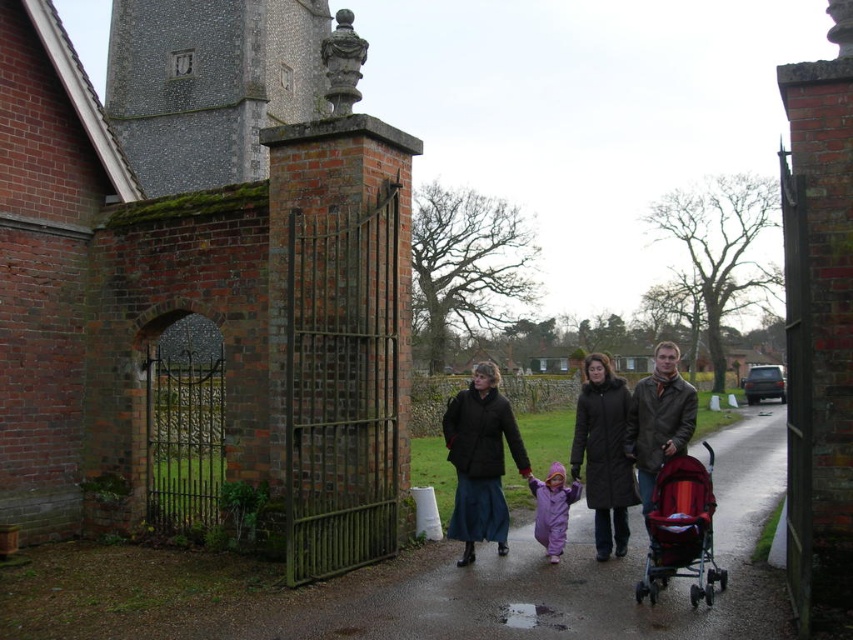
Question: Which of the following is the closest to the observer?

Choices:
 (A) quilted dark brown coat at center
 (B) matte black coat at center
 (C) purple fleece suit at center
 (D) purple fleece jacket at center

Answer: (D)

Question: Is matte black coat at center positioned at the back of red fabric stroller at right?

Choices:
 (A) no
 (B) yes

Answer: (B)

Question: Can you confirm if purple fleece jacket at center is positioned to the left of red fabric stroller at right?

Choices:
 (A) no
 (B) yes

Answer: (A)

Question: Among these objects, which one is farthest from the camera?

Choices:
 (A) matte black coat at center
 (B) quilted dark brown coat at center
 (C) purple fleece jacket at center
 (D) red fabric stroller at right

Answer: (A)

Question: Which object appears closest to the camera in this image?

Choices:
 (A) matte black coat at center
 (B) red fabric stroller at right
 (C) purple fleece jacket at center
 (D) purple fleece suit at center

Answer: (B)

Question: Can you confirm if purple fleece jacket at center is positioned to the left of quilted dark brown coat at center?

Choices:
 (A) no
 (B) yes

Answer: (A)